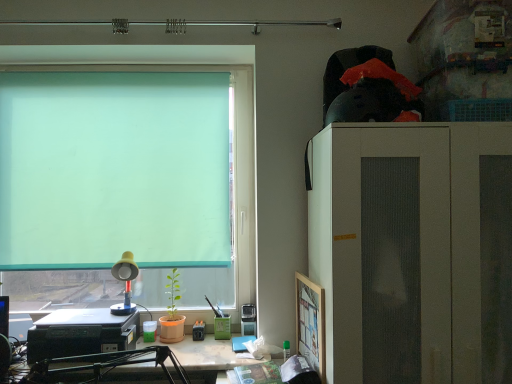
The width and height of the screenshot is (512, 384). What do you see at coordinates (178, 71) in the screenshot?
I see `green translucent roller at upper left` at bounding box center [178, 71].

Describe the element at coordinates (414, 251) in the screenshot. The height and width of the screenshot is (384, 512). I see `white matte cabinet at right` at that location.

What do you see at coordinates (125, 283) in the screenshot? I see `yellow plastic lamp at lower left` at bounding box center [125, 283].

Describe the element at coordinates (154, 364) in the screenshot. I see `matte black printer at lower left` at that location.

Locate an element on the screen. wooden picture frame at right is located at coordinates (310, 323).

You are a GUI agent. You are given a task and a screenshot of the screen. Output one action in this format:
    pyautogui.click(x=<x>, y=<y>)
    Task: Click on the green translucent roller at upper left
    The image size is (512, 384).
    Given the screenshot: What is the action you would take?
    pyautogui.click(x=178, y=71)

Can you tell me how much matte black printer at lower left and yellow plastic lamp at lower left differ in facing direction?

matte black printer at lower left and yellow plastic lamp at lower left are facing 1.1 degrees away from each other.

Based on their sizes in the image, would you say matte black printer at lower left is bigger or smaller than yellow plastic lamp at lower left?

Considering their sizes, matte black printer at lower left takes up more space than yellow plastic lamp at lower left.

Can you confirm if matte black printer at lower left is positioned to the left of yellow plastic lamp at lower left?

In fact, matte black printer at lower left is to the right of yellow plastic lamp at lower left.

Measure the distance between wooden picture frame at right and black plastic printer at lower left.

36.27 inches.

From a real-world perspective, who is located lower, wooden picture frame at right or black plastic printer at lower left?

black plastic printer at lower left, from a real-world perspective.

Is wooden picture frame at right placed right next to black plastic printer at lower left?

wooden picture frame at right and black plastic printer at lower left are not in contact.

Considering the positions of objects wooden picture frame at right and black plastic printer at lower left in the image provided, who is more to the left, wooden picture frame at right or black plastic printer at lower left?

From the viewer's perspective, black plastic printer at lower left appears more on the left side.

From a real-world perspective, which object stands above the other?

From a 3D spatial view, black plastic printer at lower left is above.

In terms of height, does black plastic printer at lower left look taller or shorter compared to matte black printer at lower left?

In the image, black plastic printer at lower left appears to be taller than matte black printer at lower left.

Is point (198, 343) farther from viewer compared to point (66, 53)?

Yes, point (198, 343) is behind point (66, 53).

Considering the sizes of matte black printer at lower left and green translucent roller at upper left in the image, is matte black printer at lower left wider or thinner than green translucent roller at upper left?

In the image, matte black printer at lower left appears to be wider than green translucent roller at upper left.

The width and height of the screenshot is (512, 384). I want to click on window on the left of matte black printer at lower left, so click(x=178, y=71).

Choose the correct answer: Is yellow plastic lamp at lower left inside black plastic printer at lower left or outside it?

yellow plastic lamp at lower left is spatially situated outside black plastic printer at lower left.

Does point (128, 289) come in front of point (72, 342)?

That is False.

From the image's perspective, which object appears higher, yellow plastic lamp at lower left or black plastic printer at lower left?

yellow plastic lamp at lower left, from the image's perspective.

Which is behind, yellow plastic lamp at lower left or black plastic printer at lower left?

yellow plastic lamp at lower left is further away from the camera.

Considering the positions of point (134, 341) and point (106, 46), is point (134, 341) closer or farther from the camera than point (106, 46)?

Point (134, 341) is positioned closer to the camera compared to point (106, 46).

Measure the distance between black plastic printer at lower left and green translucent roller at upper left.

The distance of black plastic printer at lower left from green translucent roller at upper left is 27.20 inches.

Is black plastic printer at lower left far from green translucent roller at upper left?

They are positioned close to each other.

Is black plastic printer at lower left to the left of green translucent roller at upper left from the viewer's perspective?

Correct, you'll find black plastic printer at lower left to the left of green translucent roller at upper left.

Does point (312, 294) lie in front of point (121, 312)?

That is True.

Measure the distance from wooden picture frame at right to yellow plastic lamp at lower left.

The distance of wooden picture frame at right from yellow plastic lamp at lower left is 86.53 centimeters.

Could yellow plastic lamp at lower left be considered to be inside wooden picture frame at right?

No, yellow plastic lamp at lower left is not inside wooden picture frame at right.

Does wooden picture frame at right appear on the left side of yellow plastic lamp at lower left?

Incorrect, wooden picture frame at right is not on the left side of yellow plastic lamp at lower left.

The width and height of the screenshot is (512, 384). Find the location of `desk below the yellow plastic lamp at lower left (from the image's perspective)`. desk below the yellow plastic lamp at lower left (from the image's perspective) is located at coordinates (154, 364).

Image resolution: width=512 pixels, height=384 pixels. What are the coordinates of `laptop behind the wooden picture frame at right` in the screenshot? It's located at (81, 333).

From the image, which object appears to be farther from yellow plastic lamp at lower left, black plastic printer at lower left or wooden picture frame at right?

wooden picture frame at right is positioned further to the anchor yellow plastic lamp at lower left.

When comparing their distances from wooden picture frame at right, does green translucent roller at upper left or matte black printer at lower left seem further?

green translucent roller at upper left is further to wooden picture frame at right.

Looking at the image, which one is located further to black plastic printer at lower left, yellow plastic lamp at lower left or wooden picture frame at right?

Among the two, wooden picture frame at right is located further to black plastic printer at lower left.

Which object lies further to the anchor point wooden picture frame at right, white matte cabinet at right or matte black printer at lower left?

matte black printer at lower left.

Estimate the real-world distances between objects in this image. Which object is closer to matte black printer at lower left, yellow plastic lamp at lower left or white matte cabinet at right?

Among the two, yellow plastic lamp at lower left is located nearer to matte black printer at lower left.

When comparing their distances from black plastic printer at lower left, does white matte cabinet at right or yellow plastic lamp at lower left seem further?

Based on the image, white matte cabinet at right appears to be further to black plastic printer at lower left.

From the image, which object appears to be farther from black plastic printer at lower left, green translucent roller at upper left or yellow plastic lamp at lower left?

green translucent roller at upper left lies further to black plastic printer at lower left than the other object.

Which object lies further to the anchor point wooden picture frame at right, yellow plastic lamp at lower left or white matte cabinet at right?

Based on the image, yellow plastic lamp at lower left appears to be further to wooden picture frame at right.

Locate an element on the screen. This screenshot has width=512, height=384. desk between green translucent roller at upper left and wooden picture frame at right from left to right is located at coordinates (154, 364).

Locate an element on the screen. window situated between black plastic printer at lower left and white matte cabinet at right from left to right is located at coordinates point(178,71).

I want to click on lamp located between green translucent roller at upper left and wooden picture frame at right in the left-right direction, so click(x=125, y=283).

Identify the location of laptop that lies between green translucent roller at upper left and matte black printer at lower left from top to bottom. (81, 333).